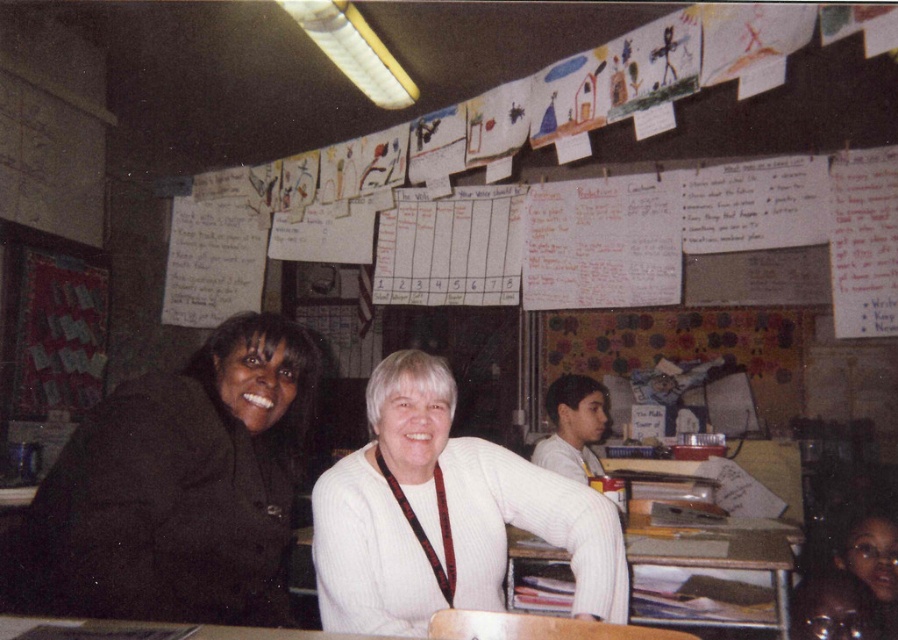
In order to click on white ribbed sweater at center in this screenshot , I will do `click(445, 515)`.

Which is more to the left, white ribbed sweater at center or wooden table at center?

white ribbed sweater at center is more to the left.

Identify the location of white ribbed sweater at center. This screenshot has width=898, height=640. (445, 515).

From the picture: Who is lower down, black matte jacket at left or white ribbed sweater at center?

white ribbed sweater at center is lower down.

Does black matte jacket at left have a greater height compared to white ribbed sweater at center?

Indeed, black matte jacket at left has a greater height compared to white ribbed sweater at center.

This screenshot has width=898, height=640. What do you see at coordinates (175, 490) in the screenshot?
I see `black matte jacket at left` at bounding box center [175, 490].

The height and width of the screenshot is (640, 898). Find the location of `black matte jacket at left`. black matte jacket at left is located at coordinates (175, 490).

Does black matte jacket at left have a lesser height compared to wooden table at center?

A: Incorrect, black matte jacket at left's height does not fall short of wooden table at center's.

Where is `black matte jacket at left`? The height and width of the screenshot is (640, 898). black matte jacket at left is located at coordinates (175, 490).

Identify the location of black matte jacket at left. (175, 490).